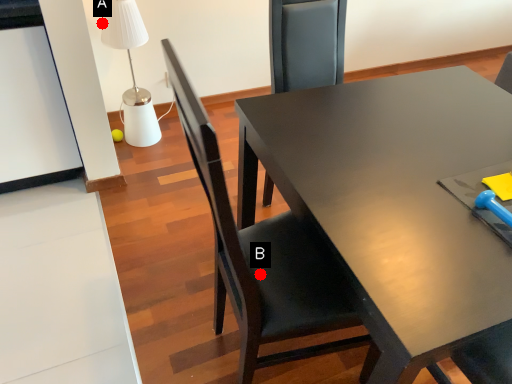
Question: Two points are circled on the image, labeled by A and B beside each circle. Which point is closer to the camera?

Choices:
 (A) A is closer
 (B) B is closer

Answer: (B)